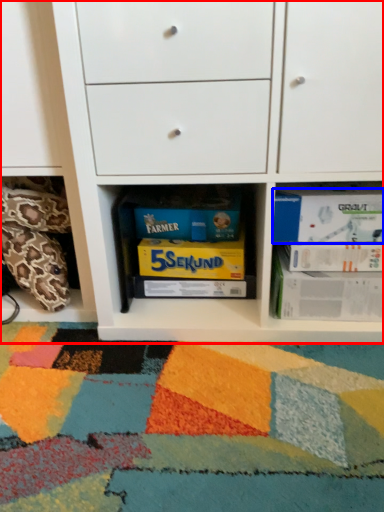
Question: Which point is further to the camera, chest of drawers (highlighted by a red box) or paperback book (highlighted by a blue box)?

Choices:
 (A) chest of drawers
 (B) paperback book

Answer: (B)